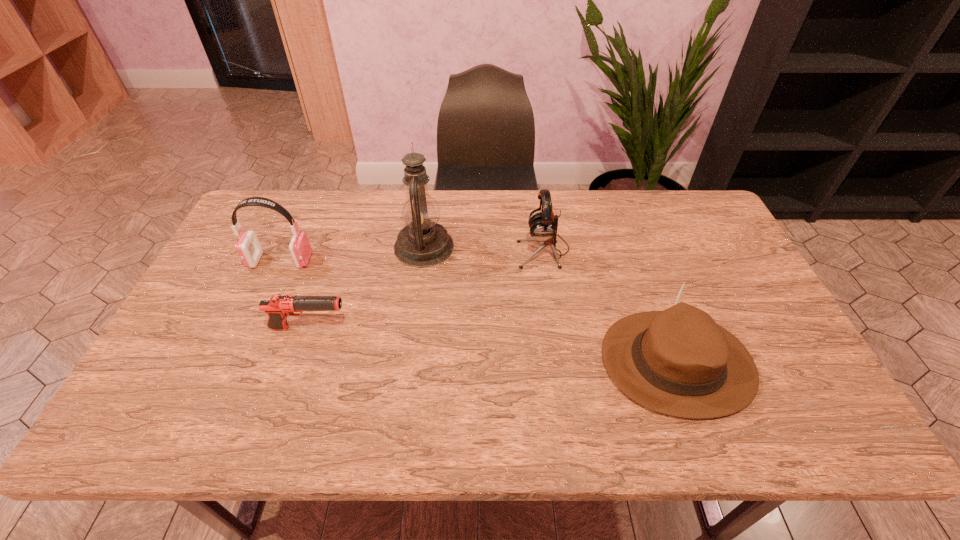
Where is `free point between the shortest object and the right earphone`? free point between the shortest object and the right earphone is located at coordinates (426, 289).

This screenshot has width=960, height=540. What are the coordinates of `free space that is in between the rightmost object and the gun` in the screenshot? It's located at (493, 346).

Image resolution: width=960 pixels, height=540 pixels. I want to click on free spot between the left earphone and the fedora, so click(478, 312).

The height and width of the screenshot is (540, 960). I want to click on free space between the third object from right to left and the gun, so click(367, 288).

The width and height of the screenshot is (960, 540). I want to click on free space between the right earphone and the oil lamp, so click(484, 248).

Locate an element on the screen. The width and height of the screenshot is (960, 540). empty space between the fourth object from left to right and the shortest object is located at coordinates (426, 289).

Where is `free spot between the third object from right to left and the gun`? free spot between the third object from right to left and the gun is located at coordinates (367, 288).

Point out which object is positioned as the second nearest to the shortest object. Please provide its 2D coordinates. Your answer should be formatted as a tuple, i.e. [(x, y)], where the tuple contains the x and y coordinates of a point satisfying the conditions above.

[(423, 242)]

Locate an element on the screen. object that ranks as the third closest to the second shortest object is located at coordinates (278, 307).